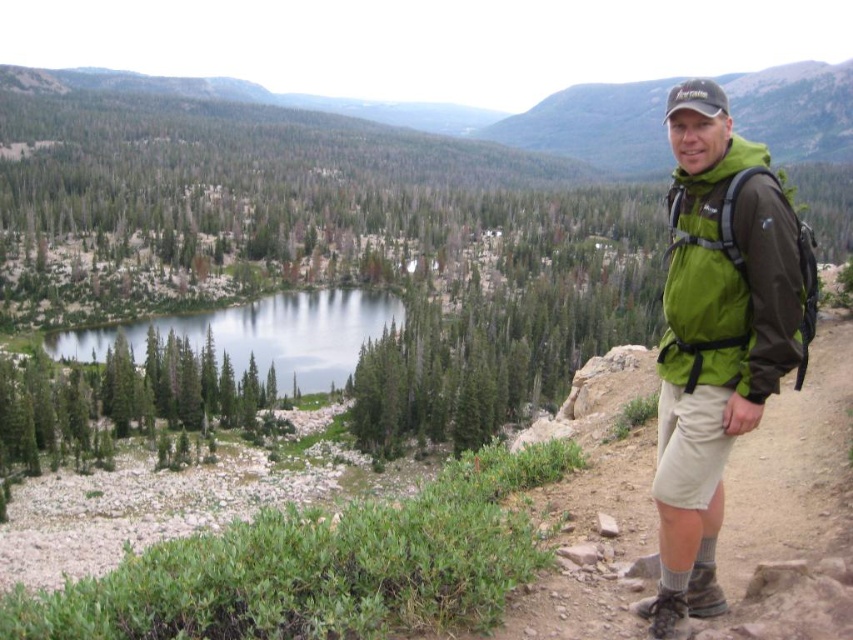
Question: Does khaki shorts at right have a greater width compared to green fabric backpack at right?

Choices:
 (A) no
 (B) yes

Answer: (B)

Question: Does green fabric jacket at right appear under khaki shorts at right?

Choices:
 (A) yes
 (B) no

Answer: (B)

Question: Estimate the real-world distances between objects in this image. Which object is closer to the khaki shorts at right?

Choices:
 (A) green fabric jacket at right
 (B) green fabric backpack at right

Answer: (A)

Question: Considering the real-world distances, which object is closest to the green fabric jacket at right?

Choices:
 (A) green fabric backpack at right
 (B) clear glass water at left
 (C) khaki shorts at right

Answer: (A)

Question: Which object is farther from the camera taking this photo?

Choices:
 (A) khaki shorts at right
 (B) green fabric backpack at right
 (C) green fabric jacket at right

Answer: (B)

Question: Is green fabric jacket at right to the right of khaki shorts at right from the viewer's perspective?

Choices:
 (A) yes
 (B) no

Answer: (B)